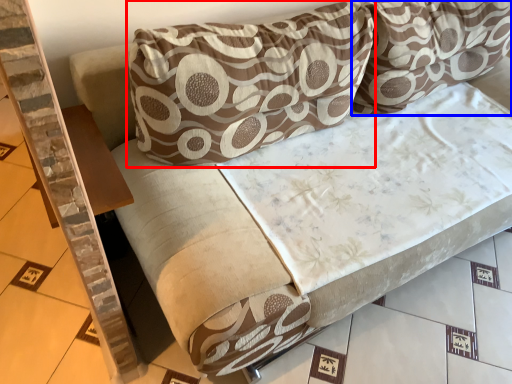
Question: Which of the following is the farthest to the observer, pillow (highlighted by a red box) or pillow (highlighted by a blue box)?

Choices:
 (A) pillow
 (B) pillow

Answer: (B)